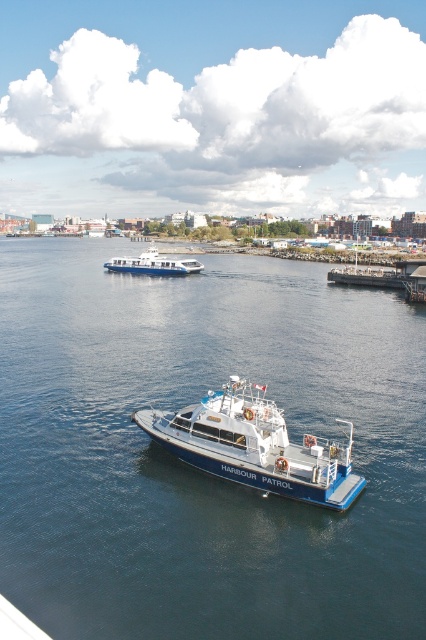
Question: Does blue water at center have a lesser width compared to wooden dock at right?

Choices:
 (A) yes
 (B) no

Answer: (B)

Question: Among these objects, which one is nearest to the camera?

Choices:
 (A) white glossy ferry at center
 (B) blue water at center

Answer: (B)

Question: Which of the following is the farthest from the observer?

Choices:
 (A) white glossy ferry at center
 (B) blue matte harbour patrol boat at center

Answer: (A)

Question: Is blue water at center positioned behind blue matte harbour patrol boat at center?

Choices:
 (A) no
 (B) yes

Answer: (A)

Question: Does white glossy ferry at center have a smaller size compared to wooden dock at right?

Choices:
 (A) no
 (B) yes

Answer: (B)

Question: Which is nearer to the white glossy ferry at center?

Choices:
 (A) wooden dock at right
 (B) blue water at center
 (C) blue matte harbour patrol boat at center

Answer: (B)